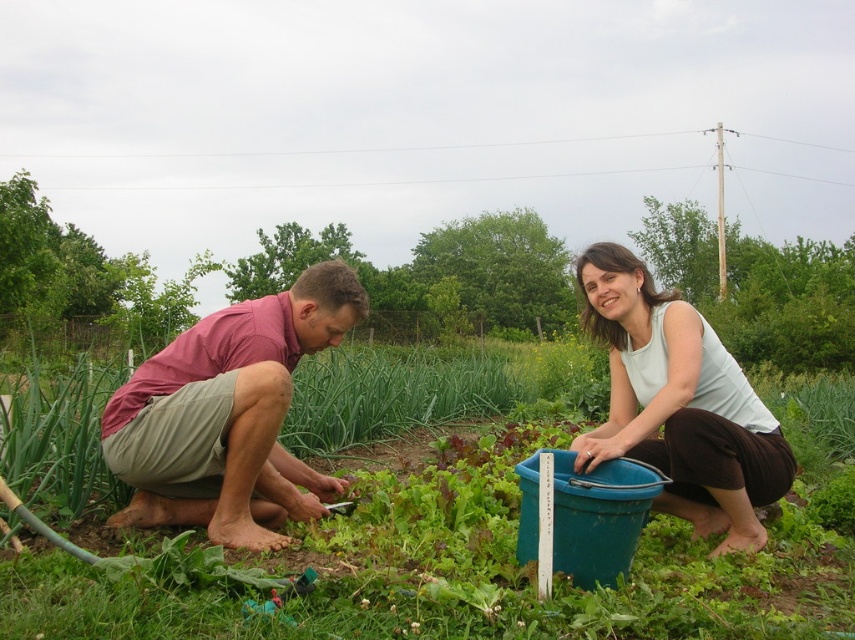
In the scene shown: You are a drone operator trying to capture a photo of the green leafy vegetables at center and the white matte tank top at center. Your drone has a camera with a maximum focus range of 6 meters. Can you take a clear photo of both objects at the same time?

The green leafy vegetables at center and the white matte tank top at center are 6.80 meters apart. Since the drone camera can only focus within 6 meters, it cannot capture both objects clearly in the same photo because they are beyond the maximum focus range.